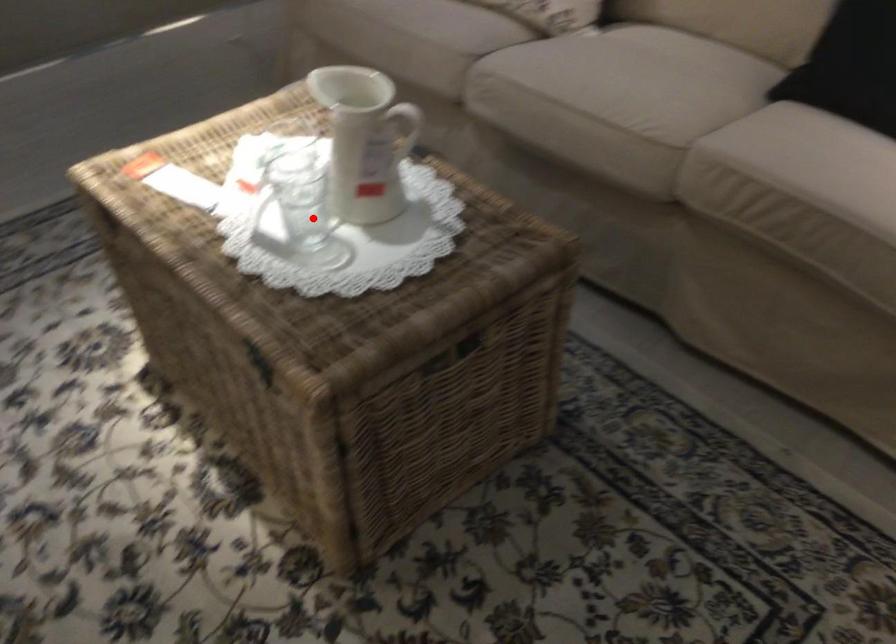
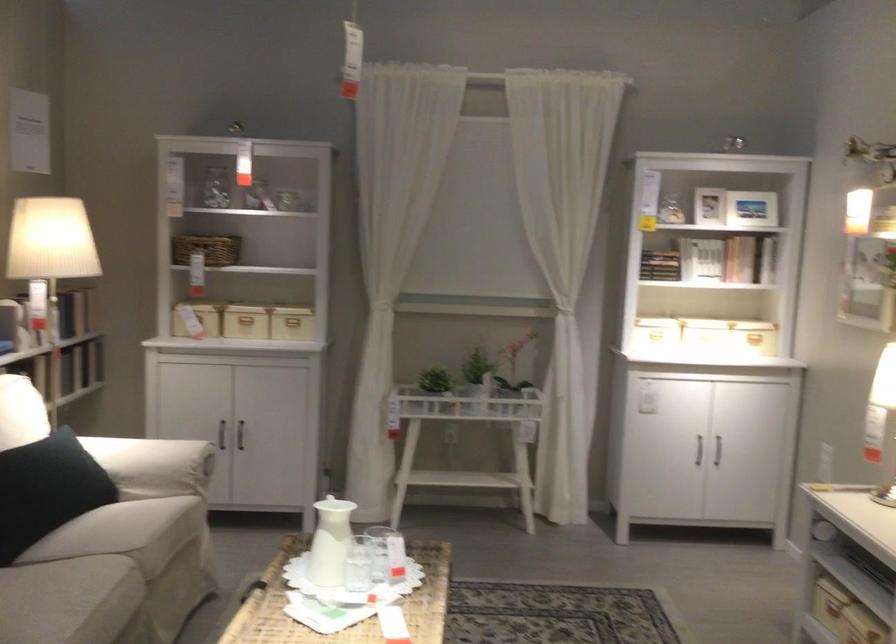
In the second image, find the point that corresponds to the highlighted location in the first image.

(386, 554)